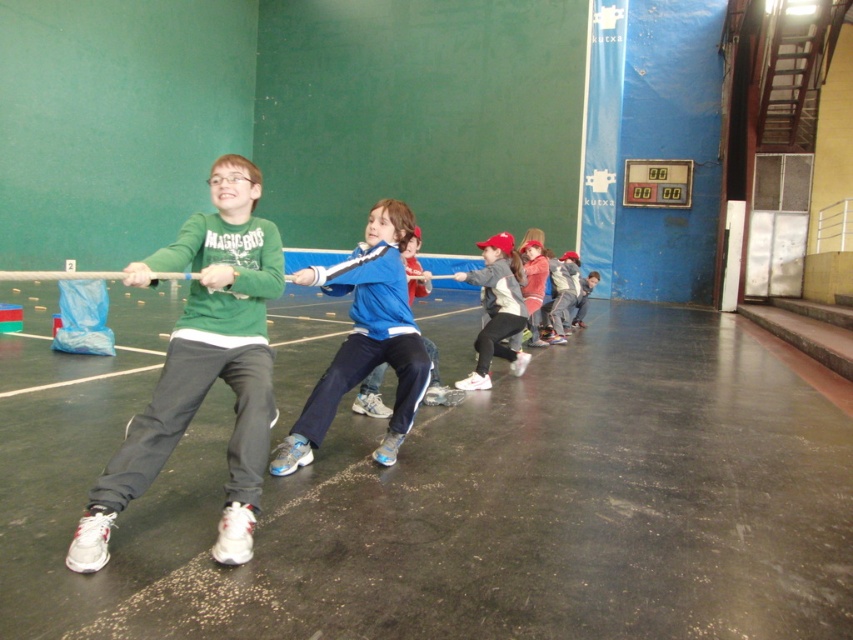
You are a photographer trying to capture a photo of the blue fabric jacket at center and blue fabric pants at center. Since you want to highlight both items, you need to ensure they are both fully visible in the frame. Based on their positions, which object should you position closer to the left side of your camera frame?

The blue fabric jacket at center should be positioned closer to the left side of the camera frame because it is already located to the left of the blue fabric pants at center in the scene.

You are a photographer standing at the back of the sports hall. You want to take a photo of the blue fabric jacket at center and blue fabric pants at center. Which one will appear larger in your photo?

The blue fabric jacket at center will appear larger in the photo because it is closer to the viewer than the blue fabric pants at center.

You are a photographer standing at the entrance of the sports hall. You want to take a photo of the children in the tug of war. The red fleece jacket at center and blue fabric pants at center are part of the same child. Which clothing item is closer to the ground?

The red fleece jacket at center is located below blue fabric pants at center, so the red fleece jacket at center is closer to the ground.